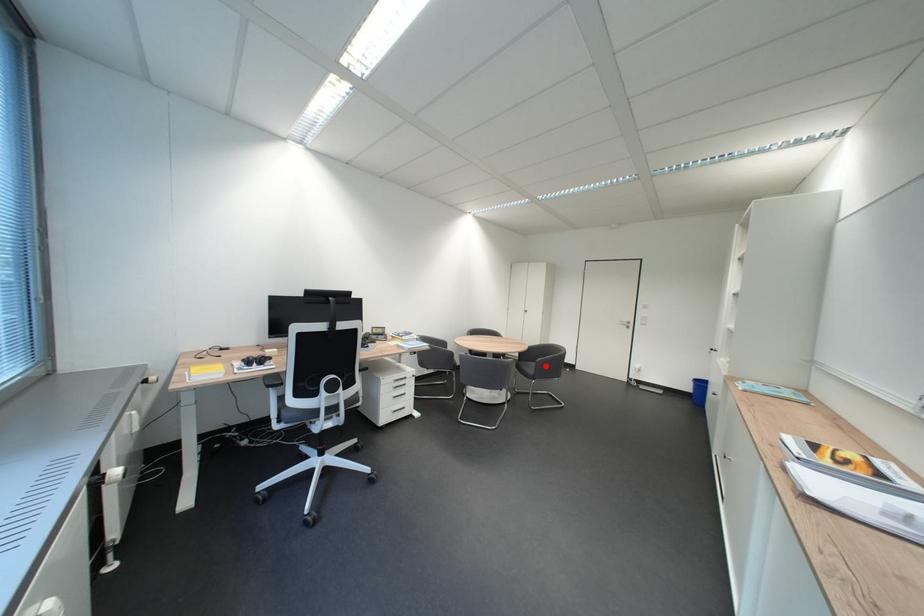
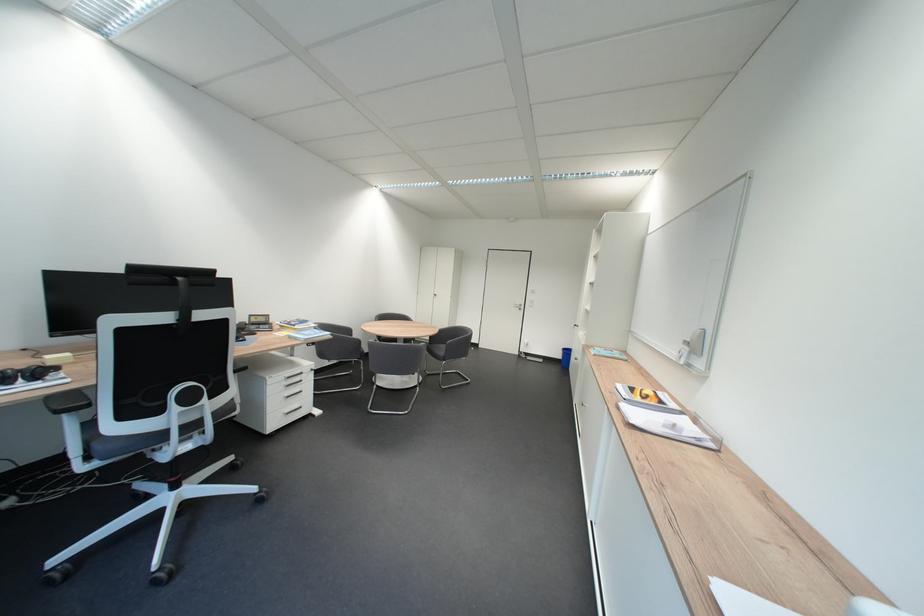
Question: I am providing you with two images of the same scene from different viewpoints. In image1, a red point is highlighted. Considering the same 3D point in image2, which of the following is correct?

Choices:
 (A) It is closer
 (B) It is farther

Answer: (A)